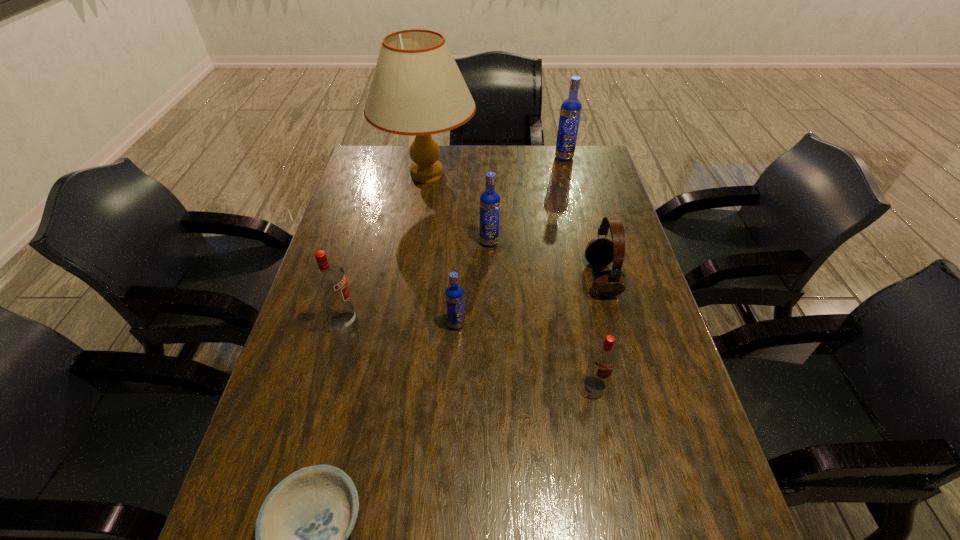
This screenshot has height=540, width=960. Identify the location of the fourth vodka from right to left. (454, 293).

You are a GUI agent. You are given a task and a screenshot of the screen. Output one action in this format:
    pyautogui.click(x=<x>, y=<y>)
    Task: Click on the leftmost blue vodka
    This screenshot has height=540, width=960.
    Given the screenshot: What is the action you would take?
    pyautogui.click(x=454, y=293)

At what (x,y) coordinates should I click in order to perform the action: click on the right red vodka. Please return your answer as a coordinate pair (x, y). Image resolution: width=960 pixels, height=540 pixels. Looking at the image, I should click on (604, 356).

This screenshot has height=540, width=960. In order to click on the nearest vodka in this screenshot , I will do (x=604, y=356).

Image resolution: width=960 pixels, height=540 pixels. I want to click on free region located on the front of the beige lampshade, so click(412, 277).

The image size is (960, 540). Identify the location of vacant region located on the front of the farthest blue vodka. (569, 179).

Where is `free location located on the right of the fifth object from left to right`? free location located on the right of the fifth object from left to right is located at coordinates (631, 242).

The image size is (960, 540). I want to click on free spot located 0.110m on the front label of the farther red vodka, so click(401, 322).

The width and height of the screenshot is (960, 540). Identify the location of free space located on the ear pads of the black headset. (468, 278).

Locate an element on the screen. The height and width of the screenshot is (540, 960). vacant region located on the ear pads of the black headset is located at coordinates (558, 278).